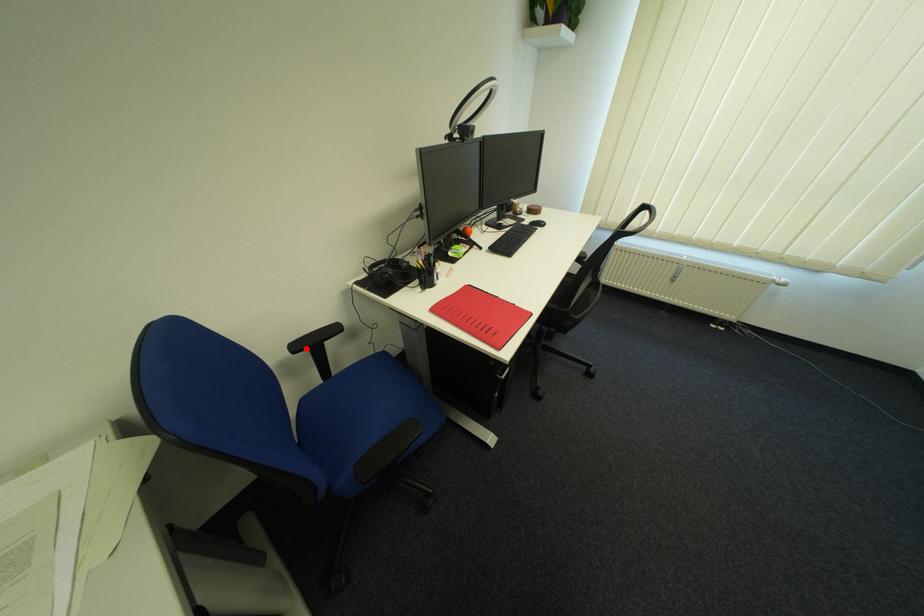
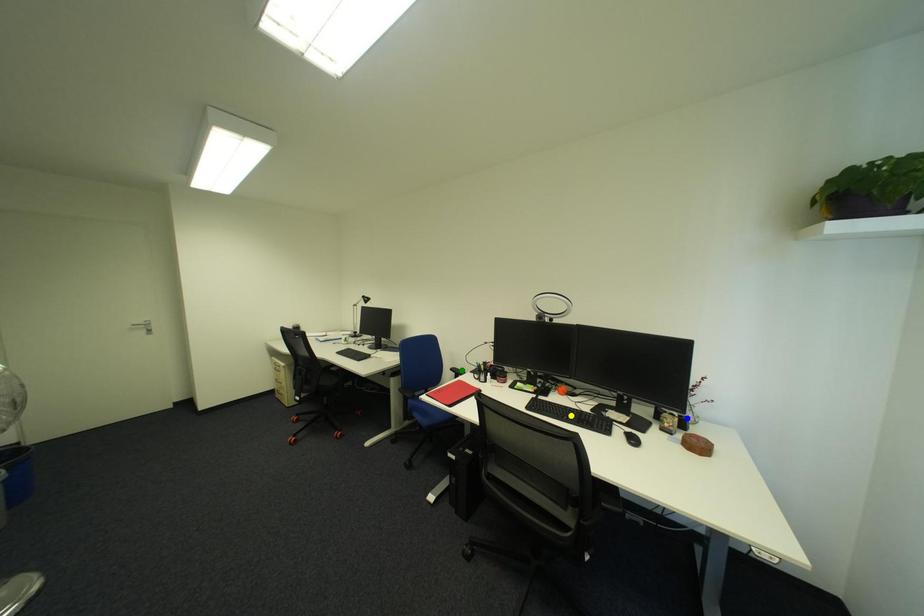
Question: I am providing you with two images of the same scene from different viewpoints. A red point is marked on the first image. You are given multiple points on the second image. Which point in image 2 is actually the same real-world point as the red point in image 1?

Choices:
 (A) yellow point
 (B) green point
 (C) blue point

Answer: (B)